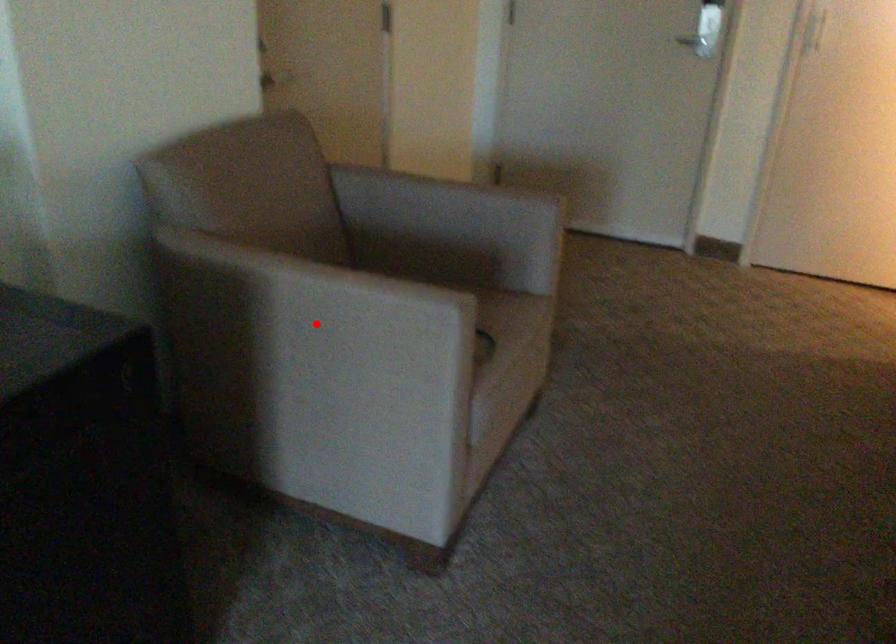
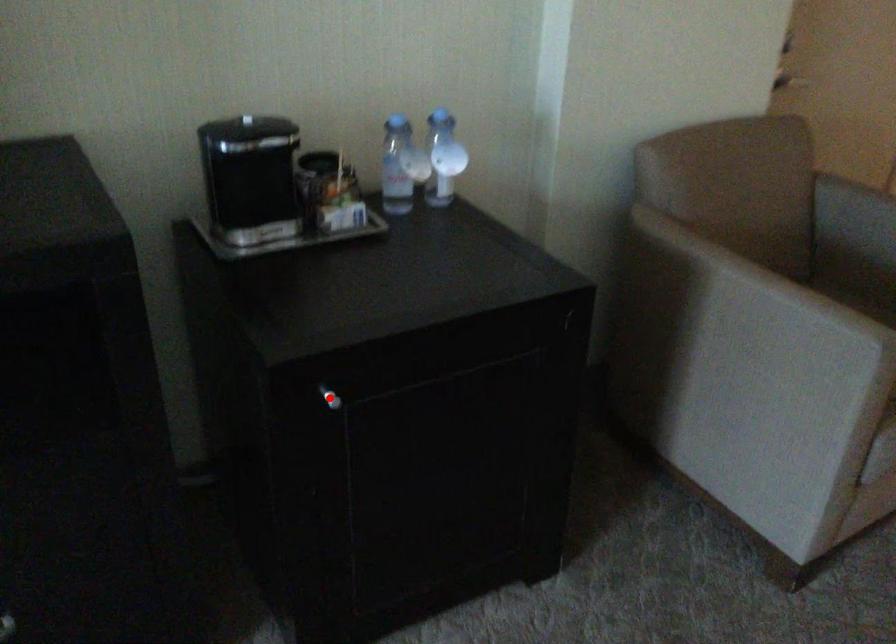
I am providing you with two images of the same scene from different viewpoints. A red point is marked on the first image and another point is marked on the second image. Is the red point in image1 aligned with the point shown in image2?

No